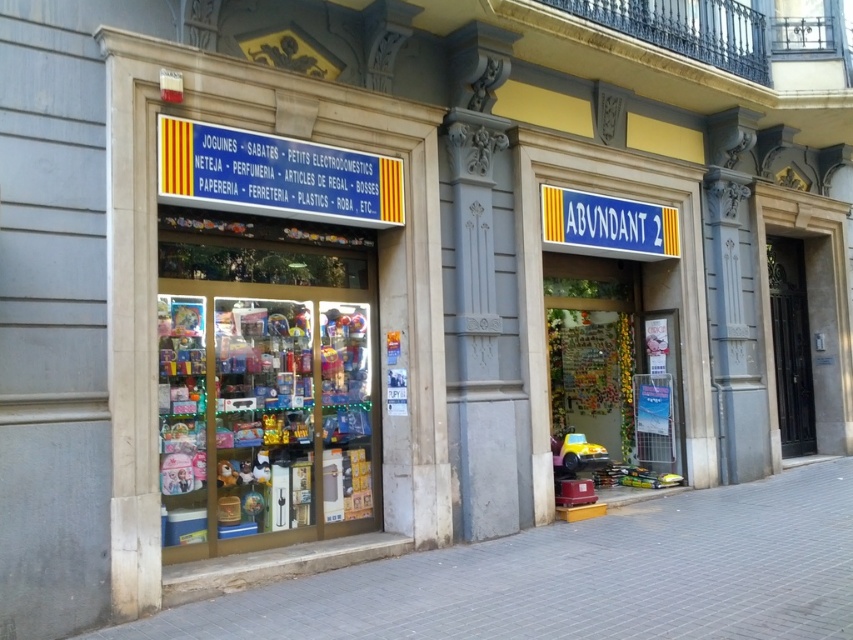
You are standing in front of the shop named ABUNDANT 2. You see the gray concrete pavement at lower left and the blue plastic sign at upper center. Which object is closer to you?

The gray concrete pavement at lower left is closer to you because it is in front of the blue plastic sign at upper center.